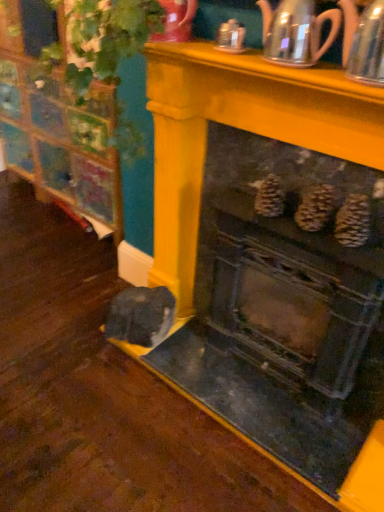
I want to click on metallic gray fireplace at center, so click(x=283, y=311).

This screenshot has width=384, height=512. What do you see at coordinates (283, 311) in the screenshot? I see `metallic gray fireplace at center` at bounding box center [283, 311].

At what (x,y) coordinates should I click in order to perform the action: click on wooden cabinet at left. Please return your answer as a coordinate pair (x, y). The height and width of the screenshot is (512, 384). Looking at the image, I should click on (58, 131).

Is metallic silver teapot at upper right, the 1th tea pot viewed from the right, positioned with its back to clear glass teapot at upper center, the first tea pot in the left-to-right sequence?

No, metallic silver teapot at upper right, the 1th tea pot viewed from the right, is not facing away from clear glass teapot at upper center, the first tea pot in the left-to-right sequence.

Which of these two, metallic silver teapot at upper right, the 1th tea pot viewed from the right, or clear glass teapot at upper center, which appears as the second tea pot when viewed from the right, stands shorter?

Standing shorter between the two is clear glass teapot at upper center, which appears as the second tea pot when viewed from the right.

From a real-world perspective, is metallic silver teapot at upper right, acting as the 2th tea pot starting from the left, above or below clear glass teapot at upper center, which appears as the second tea pot when viewed from the right?

metallic silver teapot at upper right, acting as the 2th tea pot starting from the left, is above clear glass teapot at upper center, which appears as the second tea pot when viewed from the right.

Does metallic silver teapot at upper right, acting as the 2th tea pot starting from the left, have a lesser height compared to wooden cabinet at left?

Yes, metallic silver teapot at upper right, acting as the 2th tea pot starting from the left, is shorter than wooden cabinet at left.

Is point (360, 66) positioned behind point (20, 152)?

No, (360, 66) is closer to viewer.

Is metallic silver teapot at upper right, the 1th tea pot viewed from the right, positioned with its back to wooden cabinet at left?

metallic silver teapot at upper right, the 1th tea pot viewed from the right, is not turned away from wooden cabinet at left.

From a real-world perspective, is metallic silver teapot at upper right, acting as the 2th tea pot starting from the left, located beneath wooden cabinet at left?

No.

How many degrees apart are the facing directions of wooden cabinet at left and clear glass teapot at upper center, which appears as the second tea pot when viewed from the right?

wooden cabinet at left and clear glass teapot at upper center, which appears as the second tea pot when viewed from the right, are facing 2.83 degrees away from each other.

Is wooden cabinet at left oriented away from clear glass teapot at upper center, which appears as the second tea pot when viewed from the right?

No.

Does wooden cabinet at left contain clear glass teapot at upper center, which appears as the second tea pot when viewed from the right?

No, clear glass teapot at upper center, which appears as the second tea pot when viewed from the right, is not a part of wooden cabinet at left.

Which object is further away from the camera, metallic silver teapot at upper right, acting as the 2th tea pot starting from the left, or metallic gray fireplace at center?

metallic gray fireplace at center.

Choose the correct answer: Is metallic silver teapot at upper right, the 1th tea pot viewed from the right, inside metallic gray fireplace at center or outside it?

metallic silver teapot at upper right, the 1th tea pot viewed from the right, is not enclosed by metallic gray fireplace at center.

Does metallic silver teapot at upper right, the 1th tea pot viewed from the right, have a greater width compared to metallic gray fireplace at center?

Incorrect, the width of metallic silver teapot at upper right, the 1th tea pot viewed from the right, does not surpass that of metallic gray fireplace at center.

Is metallic silver teapot at upper right, the 1th tea pot viewed from the right, oriented away from metallic gray fireplace at center?

That's not correct — metallic silver teapot at upper right, the 1th tea pot viewed from the right, is not looking away from metallic gray fireplace at center.

Is clear glass teapot at upper center, the first tea pot in the left-to-right sequence, with metallic gray fireplace at center?

clear glass teapot at upper center, the first tea pot in the left-to-right sequence, and metallic gray fireplace at center are not in contact.

Between clear glass teapot at upper center, the first tea pot in the left-to-right sequence, and metallic gray fireplace at center, which one has smaller width?

clear glass teapot at upper center, the first tea pot in the left-to-right sequence.

From a real-world perspective, is clear glass teapot at upper center, which appears as the second tea pot when viewed from the right, below metallic gray fireplace at center?

Incorrect, from a real-world perspective, clear glass teapot at upper center, which appears as the second tea pot when viewed from the right, is higher than metallic gray fireplace at center.

What's the angular difference between clear glass teapot at upper center, the first tea pot in the left-to-right sequence, and metallic gray fireplace at center's facing directions?

0.242 degrees.

Is metallic gray fireplace at center aimed at wooden cabinet at left?

Yes, metallic gray fireplace at center faces towards wooden cabinet at left.

From the image's perspective, is metallic gray fireplace at center located above or below wooden cabinet at left?

Based on their image positions, metallic gray fireplace at center is located beneath wooden cabinet at left.

Consider the image. How far apart are metallic gray fireplace at center and wooden cabinet at left?

metallic gray fireplace at center is 1.23 meters away from wooden cabinet at left.

Is metallic gray fireplace at center positioned beyond the bounds of wooden cabinet at left?

Indeed, metallic gray fireplace at center is completely outside wooden cabinet at left.

Based on their positions, is metallic gray fireplace at center located to the left or right of clear glass teapot at upper center, the first tea pot in the left-to-right sequence?

metallic gray fireplace at center is positioned on clear glass teapot at upper center, the first tea pot in the left-to-right sequence,'s right side.

Between metallic gray fireplace at center and clear glass teapot at upper center, which appears as the second tea pot when viewed from the right, which one has larger size?

metallic gray fireplace at center.

How different are the orientations of metallic gray fireplace at center and clear glass teapot at upper center, the first tea pot in the left-to-right sequence, in degrees?

0.242 degrees separate the facing orientations of metallic gray fireplace at center and clear glass teapot at upper center, the first tea pot in the left-to-right sequence.

Does metallic gray fireplace at center have a greater height compared to clear glass teapot at upper center, which appears as the second tea pot when viewed from the right?

Yes, metallic gray fireplace at center is taller than clear glass teapot at upper center, which appears as the second tea pot when viewed from the right.

What are the coordinates of `tea pot above the clear glass teapot at upper center, which appears as the second tea pot when viewed from the right (from a real-world perspective)` in the screenshot? It's located at (368, 46).

Where is `furniture above the metallic silver teapot at upper right, acting as the 2th tea pot starting from the left (from the image's perspective)`? This screenshot has height=512, width=384. furniture above the metallic silver teapot at upper right, acting as the 2th tea pot starting from the left (from the image's perspective) is located at coordinates (58, 131).

When comparing their distances from metallic silver teapot at upper right, the 1th tea pot viewed from the right, does wooden cabinet at left or metallic gray fireplace at center seem closer?

Among the two, metallic gray fireplace at center is located nearer to metallic silver teapot at upper right, the 1th tea pot viewed from the right.

Based on their spatial positions, is metallic silver teapot at upper right, acting as the 2th tea pot starting from the left, or metallic gray fireplace at center closer to wooden cabinet at left?

metallic gray fireplace at center is closer to wooden cabinet at left.

Looking at the image, which one is located closer to clear glass teapot at upper center, the first tea pot in the left-to-right sequence, metallic silver teapot at upper right, the 1th tea pot viewed from the right, or wooden cabinet at left?

metallic silver teapot at upper right, the 1th tea pot viewed from the right.

Based on their spatial positions, is metallic silver teapot at upper right, acting as the 2th tea pot starting from the left, or metallic gray fireplace at center further from clear glass teapot at upper center, which appears as the second tea pot when viewed from the right?

The object further to clear glass teapot at upper center, which appears as the second tea pot when viewed from the right, is metallic gray fireplace at center.

Which object lies further to the anchor point metallic silver teapot at upper right, acting as the 2th tea pot starting from the left, wooden cabinet at left or clear glass teapot at upper center, which appears as the second tea pot when viewed from the right?

Based on the image, wooden cabinet at left appears to be further to metallic silver teapot at upper right, acting as the 2th tea pot starting from the left.

From the picture: Based on their spatial positions, is wooden cabinet at left or clear glass teapot at upper center, the first tea pot in the left-to-right sequence, further from metallic gray fireplace at center?

Among the two, wooden cabinet at left is located further to metallic gray fireplace at center.

Which object lies nearer to the anchor point wooden cabinet at left, clear glass teapot at upper center, which appears as the second tea pot when viewed from the right, or metallic silver teapot at upper right, the 1th tea pot viewed from the right?

clear glass teapot at upper center, which appears as the second tea pot when viewed from the right, lies closer to wooden cabinet at left than the other object.

Estimate the real-world distances between objects in this image. Which object is further from wooden cabinet at left, metallic gray fireplace at center or metallic silver teapot at upper right, acting as the 2th tea pot starting from the left?

metallic silver teapot at upper right, acting as the 2th tea pot starting from the left, is positioned further to the anchor wooden cabinet at left.

This screenshot has width=384, height=512. In order to click on tea pot between clear glass teapot at upper center, the first tea pot in the left-to-right sequence, and metallic gray fireplace at center in the up-down direction in this screenshot , I will do `click(368, 46)`.

At what (x,y) coordinates should I click in order to perform the action: click on furniture between clear glass teapot at upper center, which appears as the second tea pot when viewed from the right, and metallic gray fireplace at center vertically. Please return your answer as a coordinate pair (x, y). Looking at the image, I should click on (58, 131).

Where is `tea pot located between wooden cabinet at left and metallic silver teapot at upper right, acting as the 2th tea pot starting from the left, in the left-right direction`? The width and height of the screenshot is (384, 512). tea pot located between wooden cabinet at left and metallic silver teapot at upper right, acting as the 2th tea pot starting from the left, in the left-right direction is located at coordinates (296, 31).

Locate an element on the screen. The width and height of the screenshot is (384, 512). fireplace between wooden cabinet at left and metallic silver teapot at upper right, the 1th tea pot viewed from the right, in the horizontal direction is located at coordinates (283, 311).